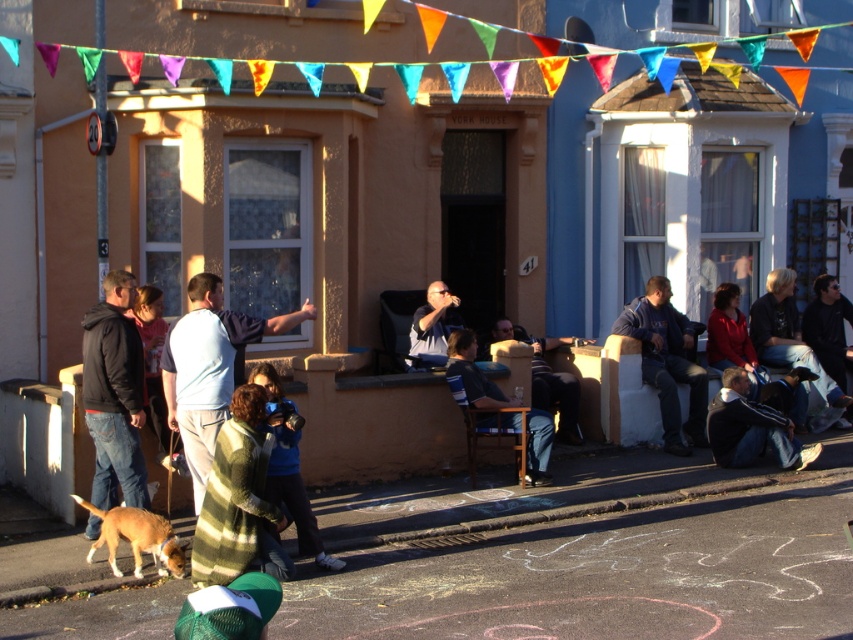
Can you confirm if dark blue jeans at lower right is wider than dark blue sweater at center?

No, dark blue jeans at lower right is not wider than dark blue sweater at center.

The width and height of the screenshot is (853, 640). I want to click on dark blue jeans at lower right, so click(x=751, y=428).

Who is shorter, dark blue hoodie at left or dark blue jeans at right?

dark blue jeans at right is shorter.

Can you confirm if dark blue hoodie at left is positioned below dark blue jeans at right?

Correct, dark blue hoodie at left is located below dark blue jeans at right.

Which is behind, point (128, 276) or point (782, 272)?

Point (782, 272)

The height and width of the screenshot is (640, 853). What are the coordinates of `dark blue hoodie at left` in the screenshot? It's located at coord(114,394).

Which is more to the left, dark blue jeans at right or brown fur dog at lower left?

Positioned to the left is brown fur dog at lower left.

Does dark blue jeans at right have a lesser width compared to brown fur dog at lower left?

In fact, dark blue jeans at right might be wider than brown fur dog at lower left.

The width and height of the screenshot is (853, 640). I want to click on dark blue jeans at right, so click(788, 336).

In order to click on dark blue jeans at right in this screenshot , I will do `click(788, 336)`.